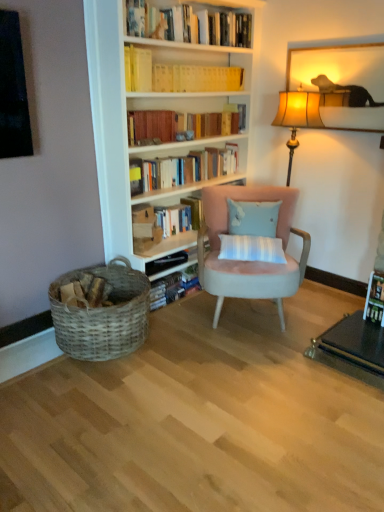
Question: Does hardcover book at upper center, which is counted as the third book, starting from the bottom, appear on the right side of yellow paperbacks at upper center, which is the 5th book from bottom to top?

Choices:
 (A) yes
 (B) no

Answer: (B)

Question: Considering the relative sizes of hardcover book at upper center, which is counted as the third book, starting from the top, and yellow paperbacks at upper center, which is the 5th book from bottom to top, in the image provided, is hardcover book at upper center, which is counted as the third book, starting from the top, shorter than yellow paperbacks at upper center, which is the 5th book from bottom to top,?

Choices:
 (A) no
 (B) yes

Answer: (A)

Question: Is hardcover book at upper center, which is counted as the third book, starting from the bottom, not close to yellow paperbacks at upper center, which is the 1th book in top-to-bottom order?

Choices:
 (A) no
 (B) yes

Answer: (A)

Question: From the image's perspective, is hardcover book at upper center, which is counted as the third book, starting from the bottom, located beneath yellow paperbacks at upper center, which is the 1th book in top-to-bottom order?

Choices:
 (A) no
 (B) yes

Answer: (B)

Question: Does hardcover book at upper center, which is counted as the third book, starting from the top, come in front of yellow paperbacks at upper center, which is the 5th book from bottom to top?

Choices:
 (A) no
 (B) yes

Answer: (B)

Question: Would you say suede pink armchair at center is inside or outside wooden picture frame at upper right?

Choices:
 (A) inside
 (B) outside

Answer: (B)

Question: Considering the relative positions of suede pink armchair at center and wooden picture frame at upper right in the image provided, is suede pink armchair at center to the left or to the right of wooden picture frame at upper right?

Choices:
 (A) left
 (B) right

Answer: (A)

Question: From the image's perspective, is suede pink armchair at center above or below wooden picture frame at upper right?

Choices:
 (A) below
 (B) above

Answer: (A)

Question: Is point (301, 271) closer or farther from the camera than point (370, 66)?

Choices:
 (A) closer
 (B) farther

Answer: (A)

Question: Is woven wood basket at lower left inside or outside of light blue fabric pillow at center?

Choices:
 (A) inside
 (B) outside

Answer: (B)

Question: In terms of width, does woven wood basket at lower left look wider or thinner when compared to light blue fabric pillow at center?

Choices:
 (A) wide
 (B) thin

Answer: (A)

Question: Considering the positions of point (132, 308) and point (243, 210), is point (132, 308) closer or farther from the camera than point (243, 210)?

Choices:
 (A) farther
 (B) closer

Answer: (B)

Question: Is woven wood basket at lower left in front of or behind light blue fabric pillow at center in the image?

Choices:
 (A) front
 (B) behind

Answer: (A)

Question: From a real-world perspective, is yellow paperbacks at upper center, which is the 5th book from bottom to top, physically located above or below wooden picture frame at upper right?

Choices:
 (A) below
 (B) above

Answer: (B)

Question: Does point (162, 81) appear closer or farther from the camera than point (296, 89)?

Choices:
 (A) farther
 (B) closer

Answer: (B)